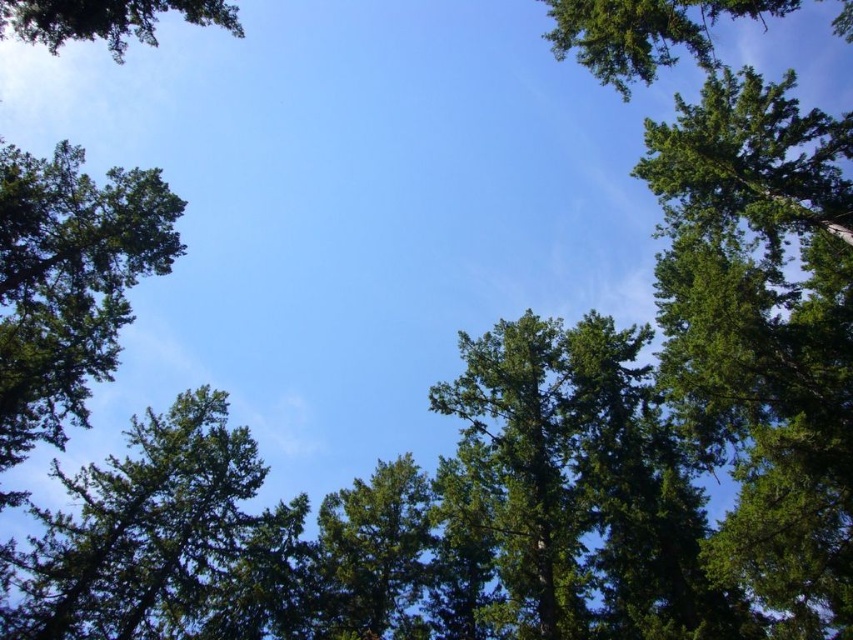
Question: Which object is closer to the camera taking this photo?

Choices:
 (A) green leafy tree at upper left
 (B) green leafy tree at upper right
 (C) green leafy tree at center

Answer: (B)

Question: Considering the real-world distances, which object is closest to the green textured tree at lower left?

Choices:
 (A) green leafy tree at upper left
 (B) green leafy tree at left
 (C) green leafy tree at upper right

Answer: (B)

Question: Does green textured tree at lower left have a larger size compared to green leafy tree at upper left?

Choices:
 (A) no
 (B) yes

Answer: (A)

Question: Does green leafy tree at left appear on the right side of green leafy tree at center?

Choices:
 (A) yes
 (B) no

Answer: (B)

Question: Which of these objects is positioned farthest from the green leafy tree at left?

Choices:
 (A) green leafy tree at upper left
 (B) green textured tree at lower left

Answer: (A)

Question: Observing the image, what is the correct spatial positioning of green textured tree at lower left in reference to green leafy tree at upper right?

Choices:
 (A) below
 (B) above

Answer: (A)